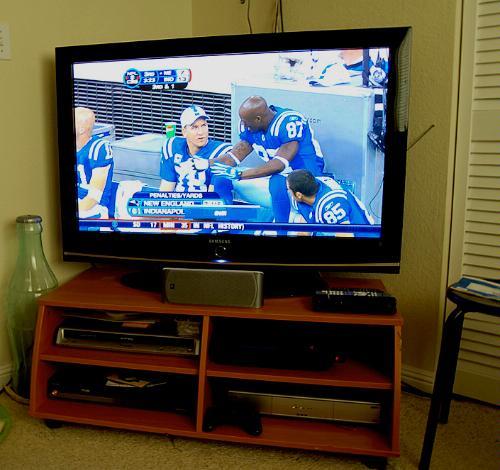
The width and height of the screenshot is (500, 470). In order to click on closet door slat in this screenshot , I will do `click(482, 231)`.